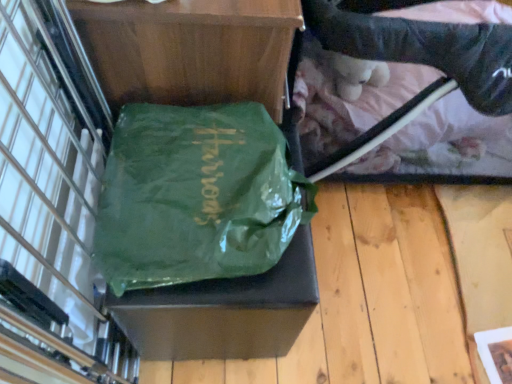
What is the approximate width of green shiny tote bag at center?

green shiny tote bag at center is 18.25 inches in width.

The width and height of the screenshot is (512, 384). Describe the element at coordinates (196, 196) in the screenshot. I see `green shiny tote bag at center` at that location.

What is the approximate height of green shiny tote bag at center?

The height of green shiny tote bag at center is 4.90 inches.

This screenshot has width=512, height=384. I want to click on green shiny tote bag at center, so click(x=196, y=196).

This screenshot has height=384, width=512. Describe the element at coordinates (442, 148) in the screenshot. I see `black plastic baby carriage at upper right` at that location.

The image size is (512, 384). I want to click on black plastic baby carriage at upper right, so click(442, 148).

What is the approximate width of black plastic baby carriage at upper right?

black plastic baby carriage at upper right is 82.19 centimeters in width.

The height and width of the screenshot is (384, 512). Find the location of `green shiny tote bag at center`. green shiny tote bag at center is located at coordinates (196, 196).

Can you confirm if green shiny tote bag at center is positioned to the left of black plastic baby carriage at upper right?

Correct, you'll find green shiny tote bag at center to the left of black plastic baby carriage at upper right.

Is green shiny tote bag at center in front of or behind black plastic baby carriage at upper right in the image?

In the image, green shiny tote bag at center appears in front of black plastic baby carriage at upper right.

Is point (211, 161) positioned in front of point (298, 63)?

That is True.

From the image's perspective, which one is positioned lower, green shiny tote bag at center or black plastic baby carriage at upper right?

From the image's view, green shiny tote bag at center is below.

From a real-world perspective, between green shiny tote bag at center and black plastic baby carriage at upper right, who is vertically lower?

black plastic baby carriage at upper right is physically lower.

Which object is thinner, green shiny tote bag at center or black plastic baby carriage at upper right?

With smaller width is green shiny tote bag at center.

Does green shiny tote bag at center have a greater height compared to black plastic baby carriage at upper right?

No, green shiny tote bag at center is not taller than black plastic baby carriage at upper right.

In the scene shown: Which of these two, green shiny tote bag at center or black plastic baby carriage at upper right, is bigger?

Bigger between the two is black plastic baby carriage at upper right.

Is green shiny tote bag at center situated inside black plastic baby carriage at upper right or outside?

The correct answer is: outside.

Is green shiny tote bag at center touching black plastic baby carriage at upper right?

They are not placed beside each other.

Could you tell me if green shiny tote bag at center is turned towards black plastic baby carriage at upper right?

No, green shiny tote bag at center is not facing towards black plastic baby carriage at upper right.

What's the angular difference between green shiny tote bag at center and black plastic baby carriage at upper right's facing directions?

The angle between the facing direction of green shiny tote bag at center and the facing direction of black plastic baby carriage at upper right is 92.9 degrees.

How far apart are green shiny tote bag at center and black plastic baby carriage at upper right?

The distance of green shiny tote bag at center from black plastic baby carriage at upper right is 18.24 inches.

Find the location of a particular element. This screenshot has height=384, width=512. baby carriage behind the green shiny tote bag at center is located at coordinates (442, 148).

Which is more to the left, black plastic baby carriage at upper right or green shiny tote bag at center?

green shiny tote bag at center is more to the left.

Does black plastic baby carriage at upper right lie behind green shiny tote bag at center?

That is True.

Which is behind, point (509, 145) or point (123, 201)?

The point (509, 145) is behind.

From the image's perspective, who appears lower, black plastic baby carriage at upper right or green shiny tote bag at center?

green shiny tote bag at center appears lower in the image.

From a real-world perspective, is black plastic baby carriage at upper right physically located above or below green shiny tote bag at center?

black plastic baby carriage at upper right is situated lower than green shiny tote bag at center in the real world.

Which of these two, black plastic baby carriage at upper right or green shiny tote bag at center, is thinner?

Thinner between the two is green shiny tote bag at center.

Considering the sizes of black plastic baby carriage at upper right and green shiny tote bag at center in the image, is black plastic baby carriage at upper right taller or shorter than green shiny tote bag at center?

In the image, black plastic baby carriage at upper right appears to be taller than green shiny tote bag at center.

Between black plastic baby carriage at upper right and green shiny tote bag at center, which one has larger size?

black plastic baby carriage at upper right.

Is green shiny tote bag at center inside black plastic baby carriage at upper right?

No, green shiny tote bag at center is not surrounded by black plastic baby carriage at upper right.

From the picture: Is black plastic baby carriage at upper right beside green shiny tote bag at center?

No, black plastic baby carriage at upper right is not making contact with green shiny tote bag at center.

Is black plastic baby carriage at upper right facing away from green shiny tote bag at center?

No, black plastic baby carriage at upper right's orientation is not away from green shiny tote bag at center.

There is a black plastic baby carriage at upper right. At what (x,y) coordinates should I click in order to perform the action: click on tote bag above it (from a real-world perspective). Please return your answer as a coordinate pair (x, y). Looking at the image, I should click on (x=196, y=196).

I want to click on tote bag below the black plastic baby carriage at upper right (from the image's perspective), so click(x=196, y=196).

At what (x,y) coordinates should I click in order to perform the action: click on baby carriage on the right of green shiny tote bag at center. Please return your answer as a coordinate pair (x, y). The width and height of the screenshot is (512, 384). Looking at the image, I should click on (442, 148).